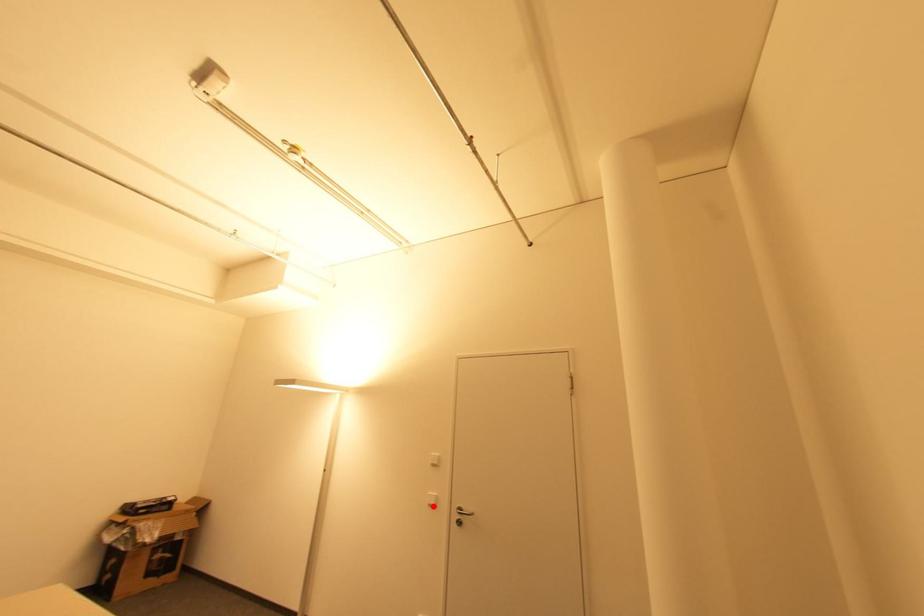
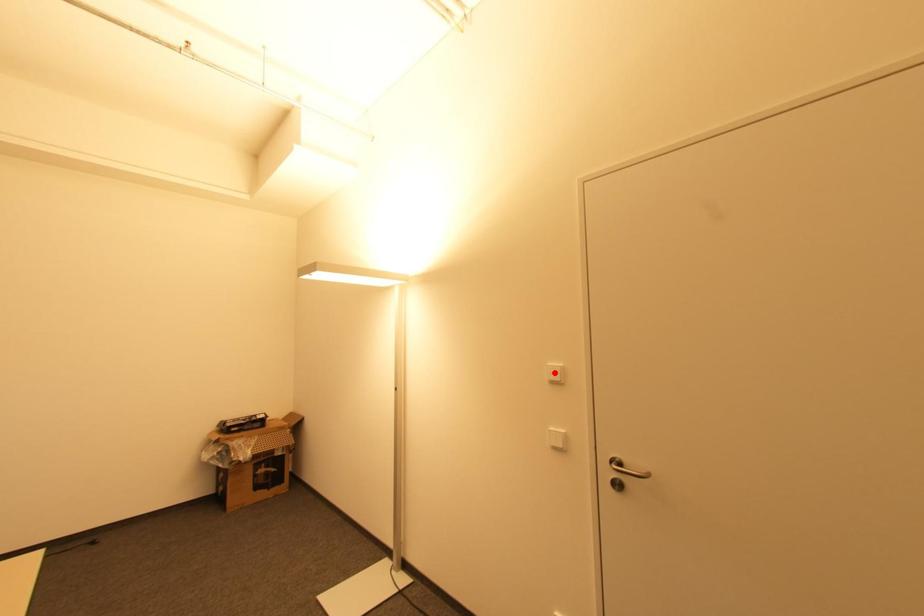
I am providing you with two images of the same scene from different viewpoints. A red point is marked on the first image and another point is marked on the second image. Does the point marked in image1 correspond to the same location as the one in image2?

No